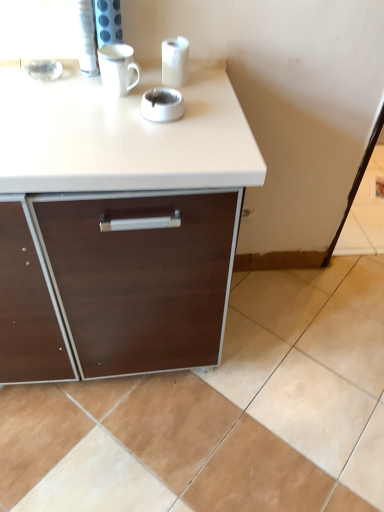
Question: Considering the relative sizes of beige ceramic tile at lower right and white glossy mug at upper center in the image provided, is beige ceramic tile at lower right thinner than white glossy mug at upper center?

Choices:
 (A) yes
 (B) no

Answer: (B)

Question: Considering the relative sizes of beige ceramic tile at lower right and white glossy mug at upper center in the image provided, is beige ceramic tile at lower right taller than white glossy mug at upper center?

Choices:
 (A) yes
 (B) no

Answer: (B)

Question: Is beige ceramic tile at lower right placed right next to white glossy mug at upper center?

Choices:
 (A) no
 (B) yes

Answer: (A)

Question: From the image's perspective, is beige ceramic tile at lower right located above white glossy mug at upper center?

Choices:
 (A) yes
 (B) no

Answer: (B)

Question: Is beige ceramic tile at lower right facing towards white glossy mug at upper center?

Choices:
 (A) no
 (B) yes

Answer: (A)

Question: Could white glossy mug at upper center be considered to be inside beige ceramic tile at lower right?

Choices:
 (A) yes
 (B) no

Answer: (B)

Question: Is beige ceramic tile at lower right facing away from white glossy paper towel at upper center?

Choices:
 (A) no
 (B) yes

Answer: (A)

Question: Is there a large distance between beige ceramic tile at lower right and white glossy paper towel at upper center?

Choices:
 (A) no
 (B) yes

Answer: (B)

Question: Is beige ceramic tile at lower right outside of white glossy paper towel at upper center?

Choices:
 (A) yes
 (B) no

Answer: (A)

Question: From a real-world perspective, is beige ceramic tile at lower right on white glossy paper towel at upper center?

Choices:
 (A) yes
 (B) no

Answer: (B)

Question: From the image's perspective, is beige ceramic tile at lower right below white glossy paper towel at upper center?

Choices:
 (A) no
 (B) yes

Answer: (B)

Question: Is beige ceramic tile at lower right shorter than white glossy paper towel at upper center?

Choices:
 (A) no
 (B) yes

Answer: (B)

Question: Is white glossy ashtray at center not near white glossy mug at upper center?

Choices:
 (A) no
 (B) yes

Answer: (A)